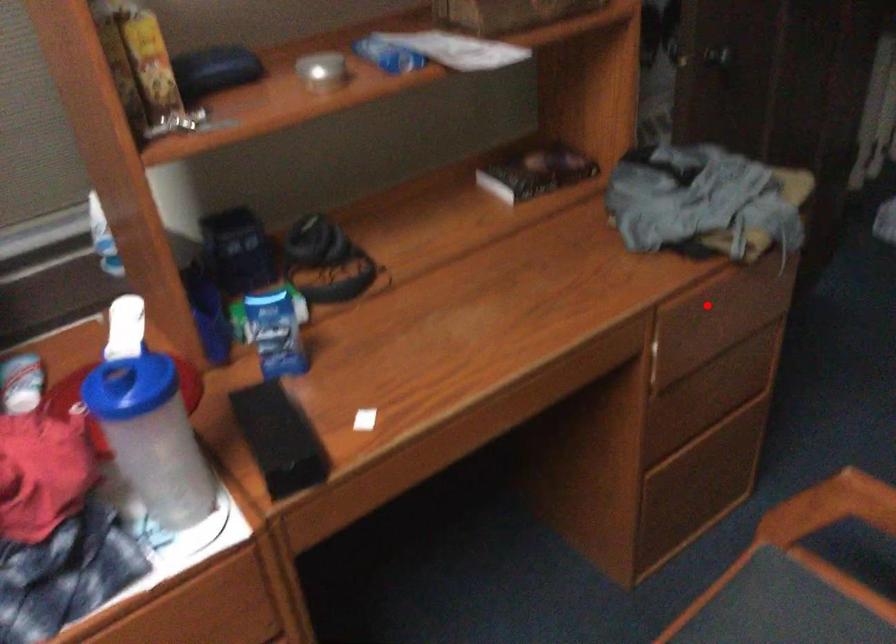
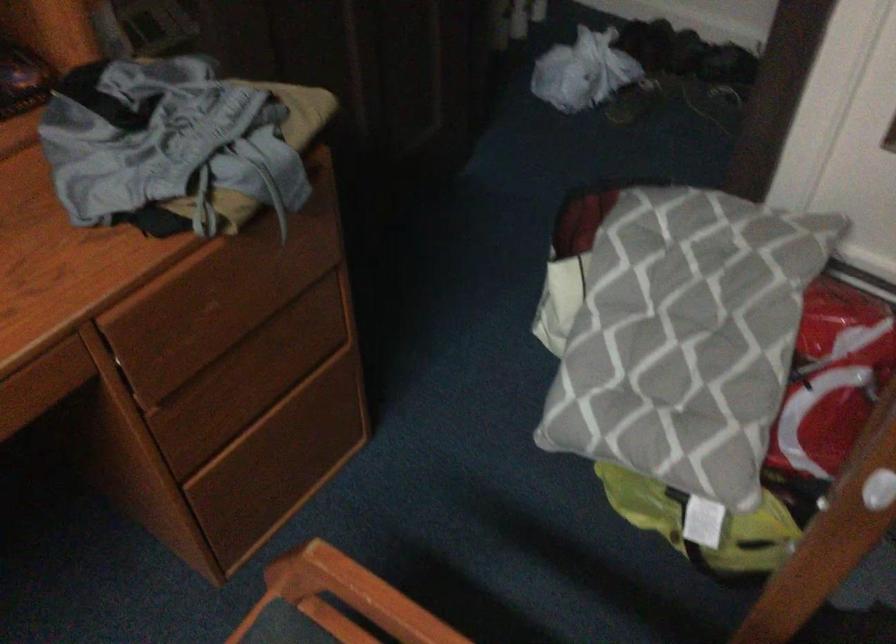
Locate, in the second image, the point that corresponds to the highlighted location in the first image.

(196, 294)